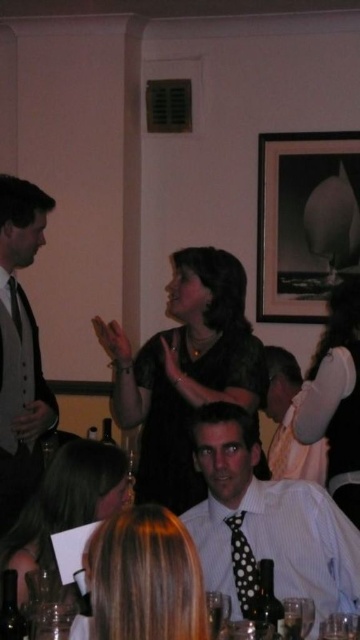
Question: Does blonde hair at center have a smaller size compared to black dotted tie at center?

Choices:
 (A) no
 (B) yes

Answer: (A)

Question: Which of these objects is positioned closest to the blonde hair at center?

Choices:
 (A) black matte picture frame at upper right
 (B) transparent glass at lower center

Answer: (B)

Question: Which point is farther to the camera?

Choices:
 (A) (264, 524)
 (B) (178, 332)
 (C) (300, 616)

Answer: (B)

Question: Can you confirm if blonde hair at center is wider than white satin dress at center?

Choices:
 (A) yes
 (B) no

Answer: (A)

Question: Is white satin dress at center to the left of black dotted tie at center from the viewer's perspective?

Choices:
 (A) no
 (B) yes

Answer: (A)

Question: Which object appears farthest from the camera in this image?

Choices:
 (A) white satin dress at center
 (B) black matte picture frame at upper right

Answer: (B)